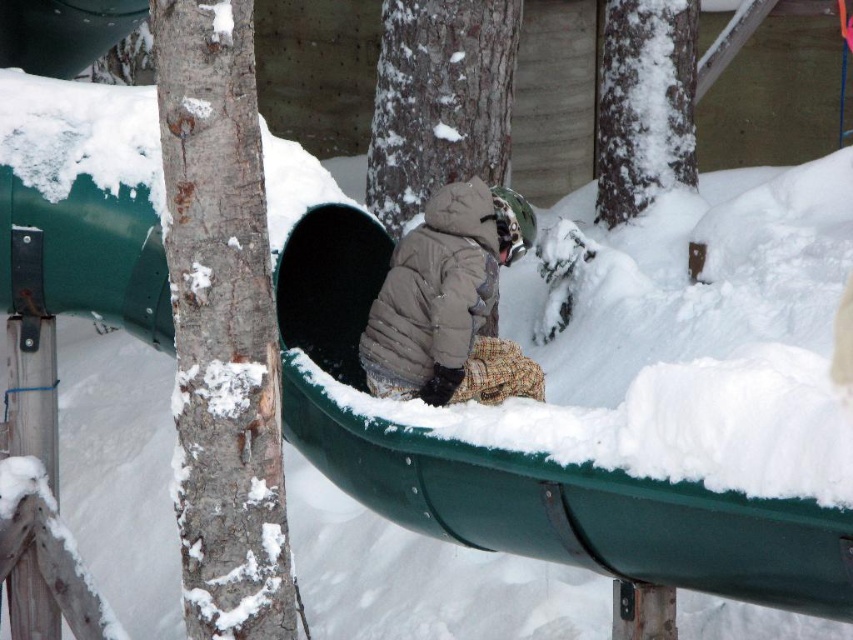
You are standing at the playground and see the smooth bark tree at center. Where is it located in terms of coordinates?

The smooth bark tree at center is located at coordinates point (x=439, y=99).

You are standing at the entrance of the playground and see two points marked in the image. Which point, point (x=199, y=52) or point (x=440, y=212), is closer to you?

Point (x=199, y=52) is in front of point (x=440, y=212), so it is closer to you.